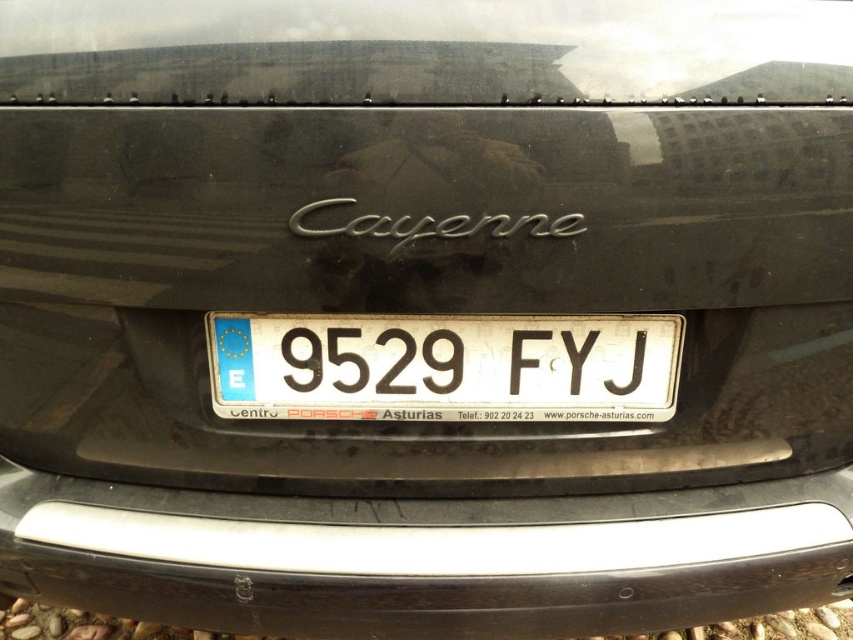
Question: Which point is closer to the camera taking this photo?

Choices:
 (A) (183, 568)
 (B) (598, 326)

Answer: (B)

Question: Is silver metallic bumper at center to the left of white plastic license plate at center from the viewer's perspective?

Choices:
 (A) yes
 (B) no

Answer: (A)

Question: Does silver metallic bumper at center have a lesser width compared to white plastic license plate at center?

Choices:
 (A) no
 (B) yes

Answer: (A)

Question: Is silver metallic bumper at center below white plastic license plate at center?

Choices:
 (A) no
 (B) yes

Answer: (B)

Question: Which point is farther to the camera?

Choices:
 (A) (390, 579)
 (B) (341, 317)

Answer: (B)

Question: Which object appears farthest from the camera in this image?

Choices:
 (A) white plastic license plate at center
 (B) silver metallic bumper at center

Answer: (A)